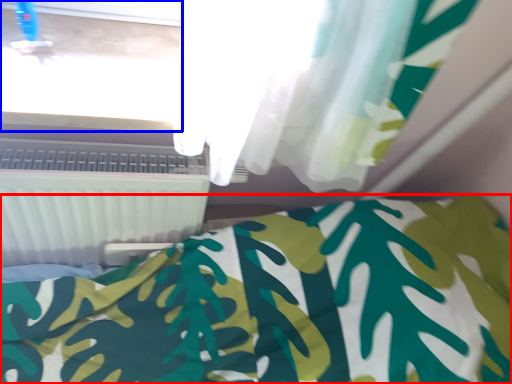
Question: Which point is closer to the camera, bed (highlighted by a red box) or window frame (highlighted by a blue box)?

Choices:
 (A) bed
 (B) window frame

Answer: (A)